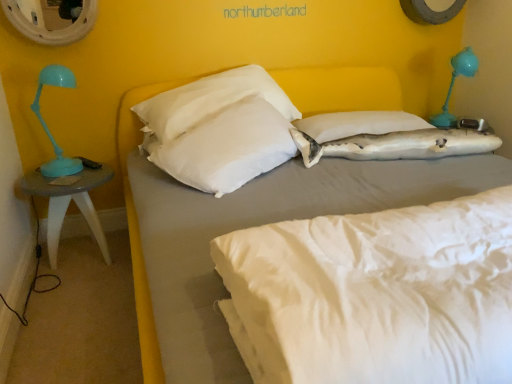
Question: From the image's perspective, is white fabric pillow at center, the 2th pillow viewed from the right, above or below metallic circular mirror at upper left?

Choices:
 (A) above
 (B) below

Answer: (B)

Question: In terms of height, does white fabric pillow at center, the 2th pillow viewed from the right, look taller or shorter compared to metallic circular mirror at upper left?

Choices:
 (A) short
 (B) tall

Answer: (A)

Question: Based on their relative distances, which object is farther from the white matte bed at center?

Choices:
 (A) metallic circular mirror at upper left
 (B) white fabric mattress at center
 (C) white fabric pillow at center, which ranks as the 2th pillow in left-to-right order
 (D) white fabric shark at center, marked as the third pillow in a left-to-right arrangement
 (E) matte gray table at left

Answer: (B)

Question: Considering the real-world distances, which object is farthest from the white soft pillow at center, which is the third pillow from right to left?

Choices:
 (A) metallic circular mirror at upper left
 (B) white fabric mattress at center
 (C) white matte bed at center
 (D) white fabric pillow at center, the 2th pillow viewed from the right
 (E) matte gray table at left

Answer: (B)